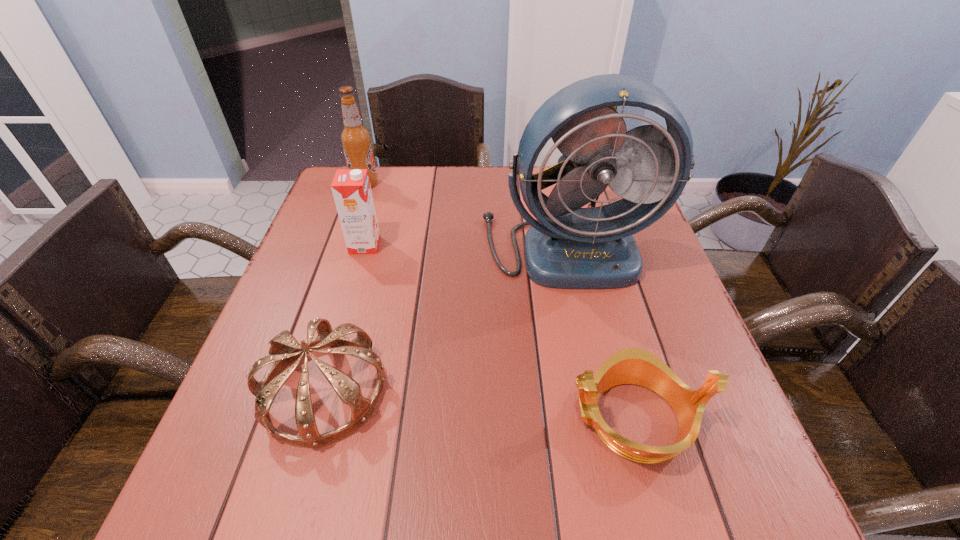
You are a GUI agent. You are given a task and a screenshot of the screen. Output one action in this format:
    pyautogui.click(x=<x>, y=<y>)
    Task: Click on the vacant area that satisfies the following two spatial constraints: 1. on the front label of the third tallest object; 2. on the right side of the farthest object
    
    Given the screenshot: What is the action you would take?
    pyautogui.click(x=344, y=245)

You are a GUI agent. You are given a task and a screenshot of the screen. Output one action in this format:
    pyautogui.click(x=<x>, y=<y>)
    Task: Click on the free space in the image that satisfies the following two spatial constraints: 1. on the front label of the beer bottle; 2. on the left side of the carton
    
    Given the screenshot: What is the action you would take?
    pyautogui.click(x=344, y=245)

You are a GUI agent. You are given a task and a screenshot of the screen. Output one action in this format:
    pyautogui.click(x=<x>, y=<y>)
    Task: Click on the free spot that satisfies the following two spatial constraints: 1. on the back side of the carton; 2. on the front label of the beer bottle
    
    Given the screenshot: What is the action you would take?
    pyautogui.click(x=383, y=184)